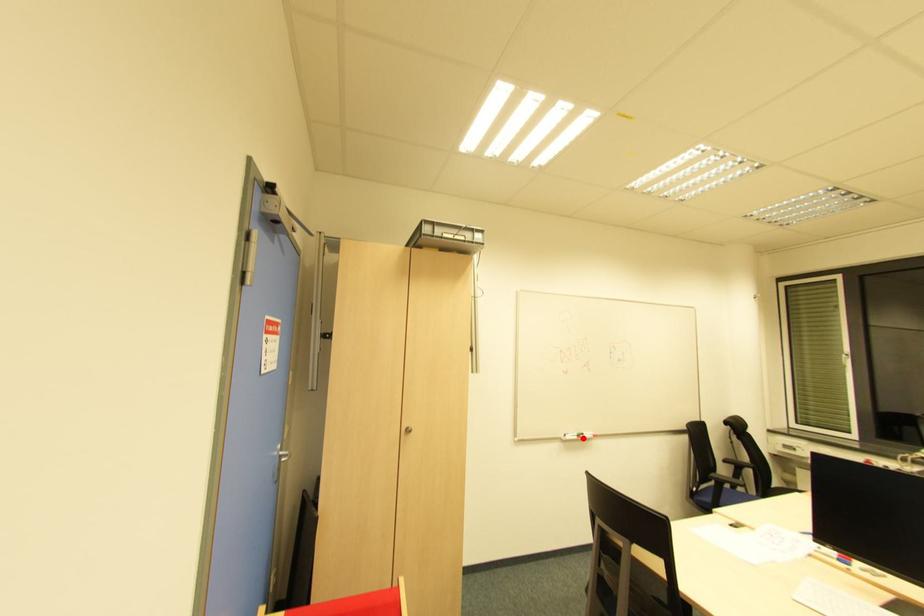
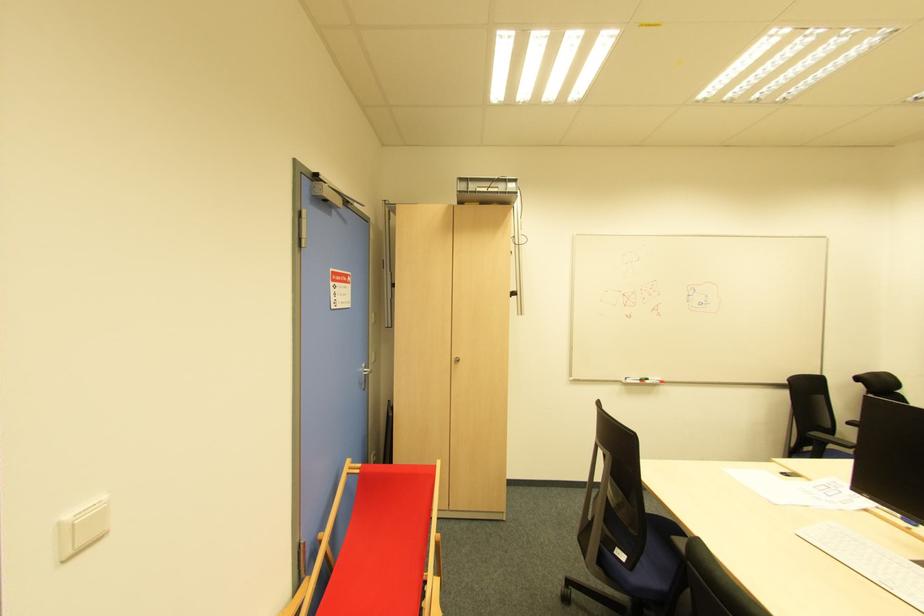
The point at the highlighted location is marked in the first image. Where is the corresponding point in the second image?

(647, 383)